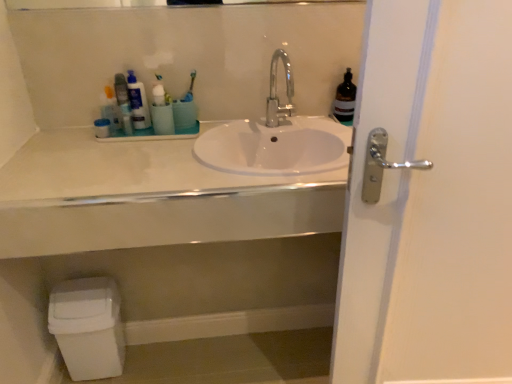
Locate an element on the screen. This screenshot has width=512, height=384. vacant space situated on the left part of translucent plastic bottle at upper left, which is counted as the third toiletry, starting from the left is located at coordinates (75, 133).